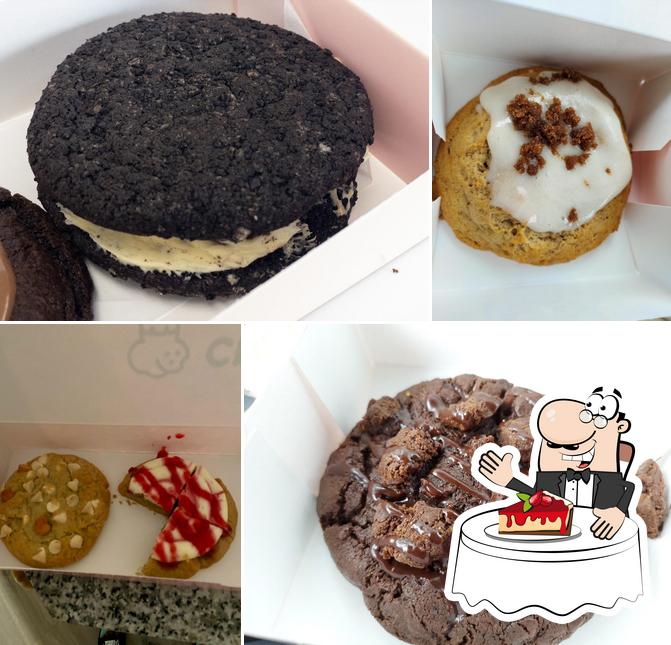
I want to click on box, so click(386, 237), click(623, 33), click(135, 390), click(266, 511).